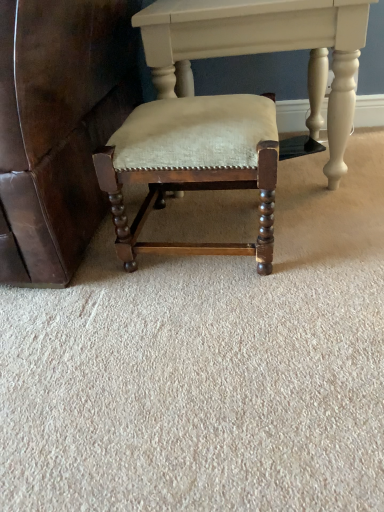
Find the location of `free space on the front side of matte white table at center`. free space on the front side of matte white table at center is located at coordinates (287, 251).